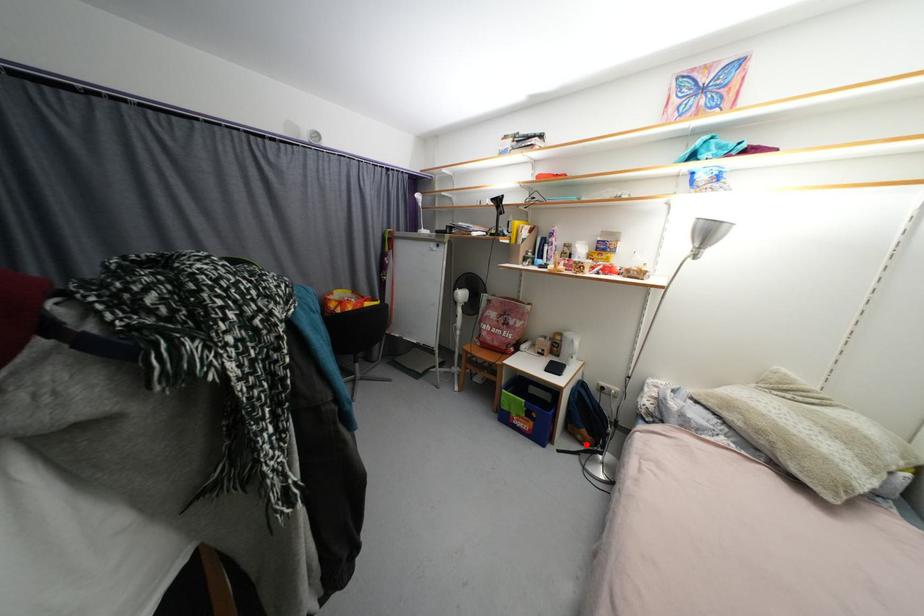
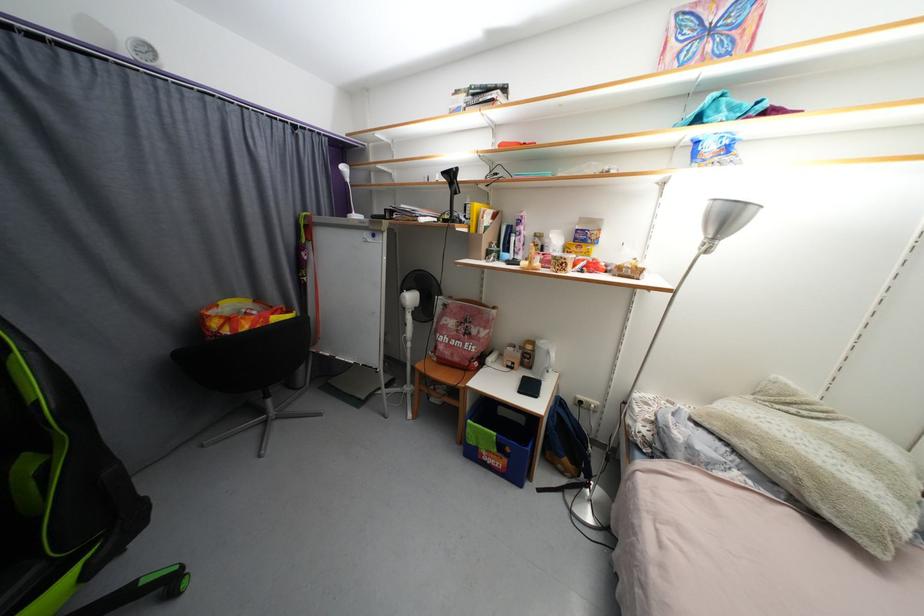
Locate, in the second image, the point that corresponds to the highlighted location in the first image.

(567, 475)